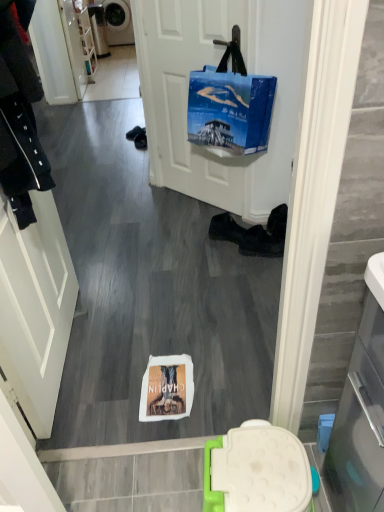
Where is `unoccupied area in front of black leather boots at lower center, arranged as the 1th footwear when viewed from the right`? The height and width of the screenshot is (512, 384). unoccupied area in front of black leather boots at lower center, arranged as the 1th footwear when viewed from the right is located at coordinates (256, 269).